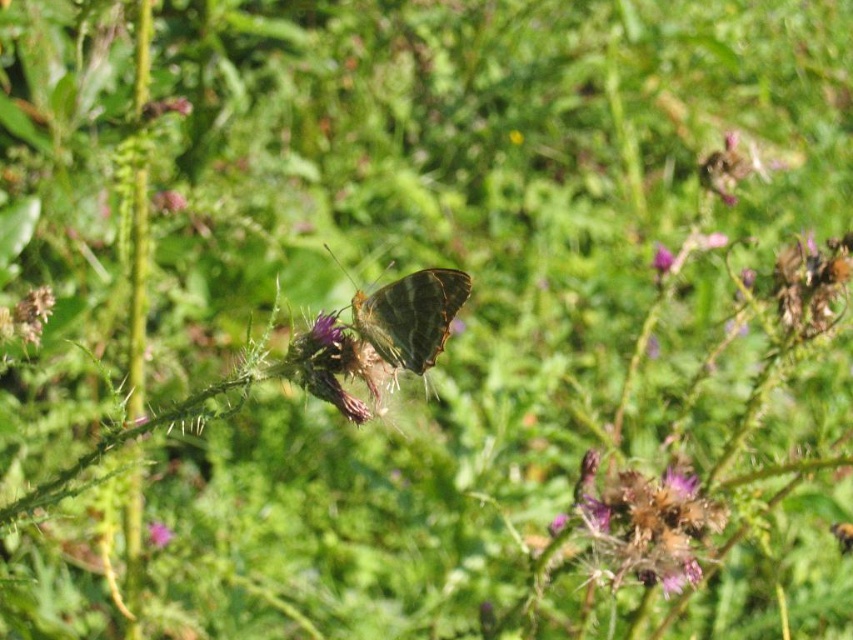
Question: Does shiny brown butterfly at center have a smaller size compared to purple matte flower at center?

Choices:
 (A) no
 (B) yes

Answer: (A)

Question: Is purple fuzzy thistle at center in front of purple matte flower at center?

Choices:
 (A) yes
 (B) no

Answer: (A)

Question: Which of the following is the farthest from the observer?

Choices:
 (A) purple matte flower at center
 (B) purple fuzzy thistle at center
 (C) purple fuzzy flower at center

Answer: (C)

Question: Which object is farther from the camera taking this photo?

Choices:
 (A) purple fuzzy flower at center
 (B) purple matte flower at center

Answer: (A)

Question: Which point is farther to the camera?

Choices:
 (A) [351, 326]
 (B) [165, 538]
 (C) [618, 579]
 (D) [666, 257]

Answer: (B)

Question: Is shiny brown butterfly at center behind purple fuzzy flower at center?

Choices:
 (A) yes
 (B) no

Answer: (B)